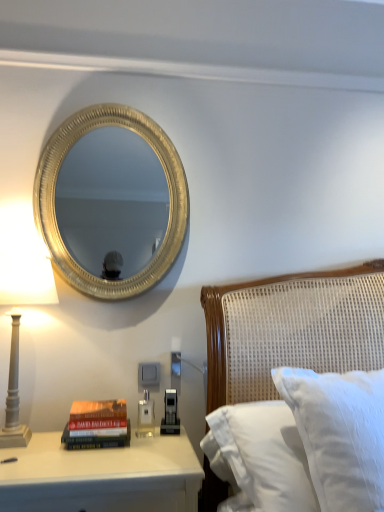
Locate an element on the screen. Image resolution: width=384 pixels, height=512 pixels. unoccupied region to the right of gray columnar lamp at left is located at coordinates (88, 459).